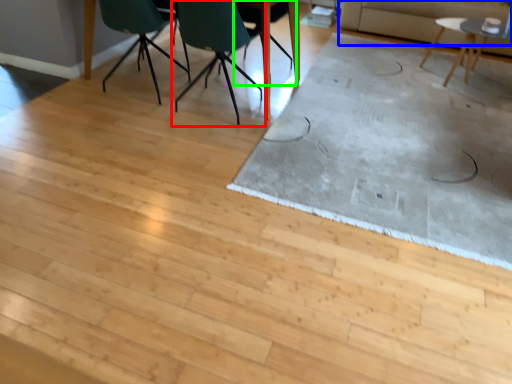
Question: Which object is the closest to the chair (highlighted by a red box)? Choose among these: couch (highlighted by a blue box) or chair (highlighted by a green box).

Choices:
 (A) couch
 (B) chair

Answer: (B)